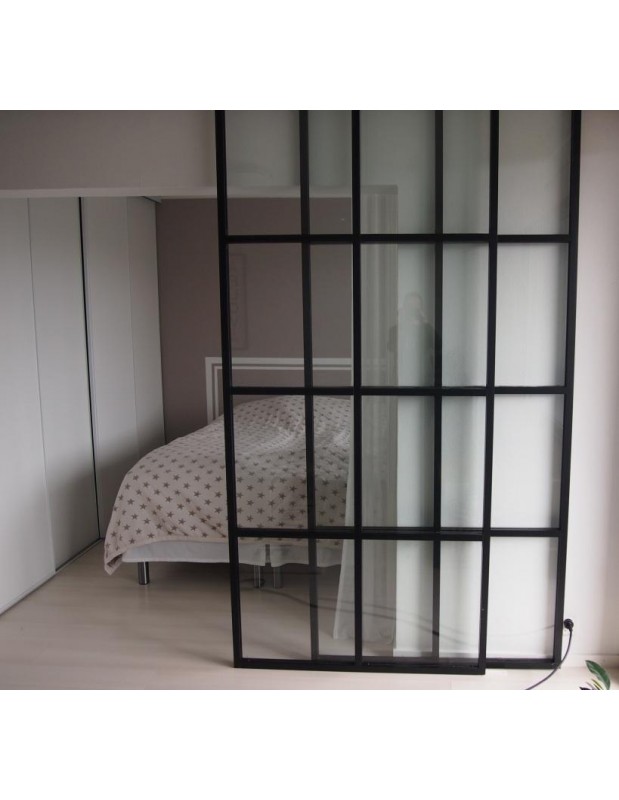
This screenshot has width=619, height=800. I want to click on floor, so click(52, 658).